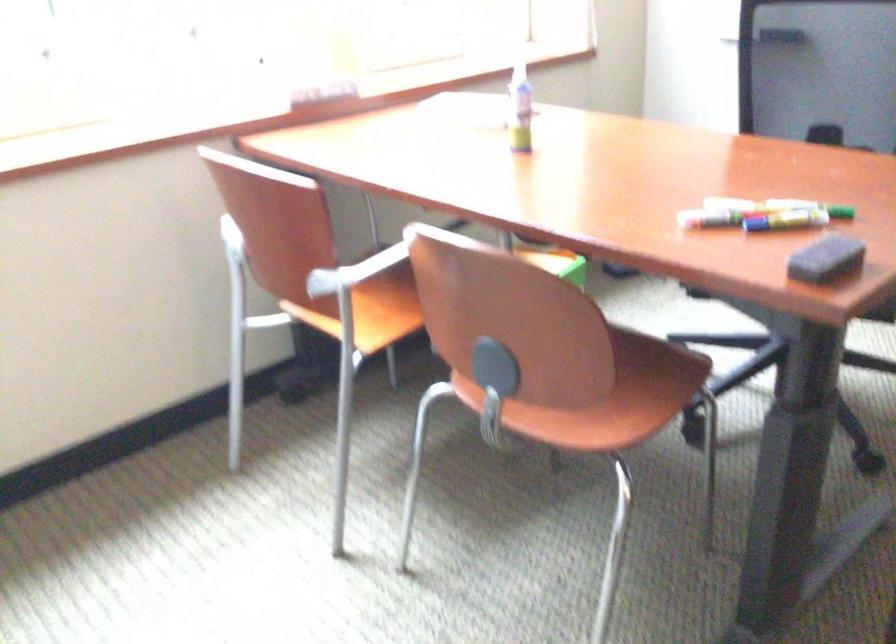
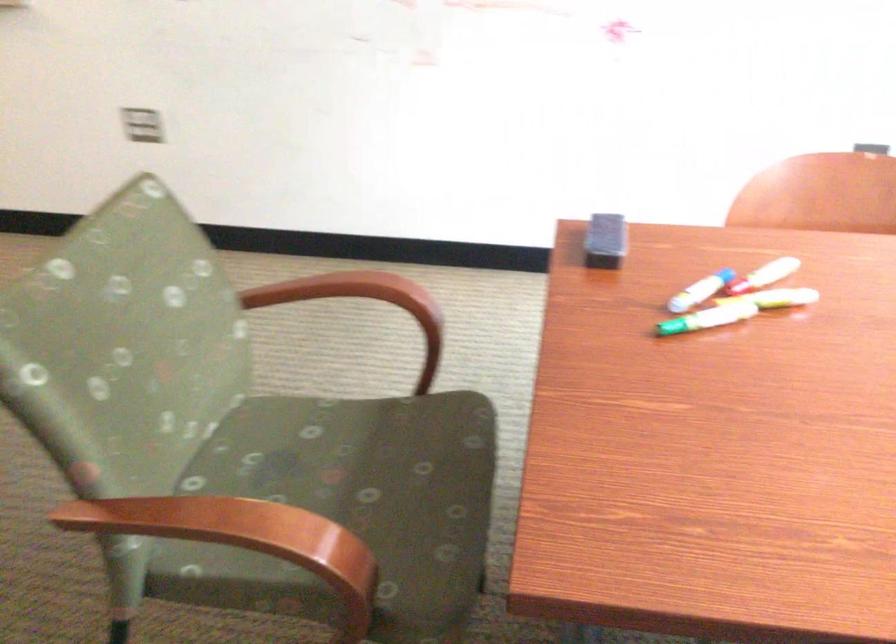
Where in the second image is the point corresponding to the point at 721,210 from the first image?

(776, 298)